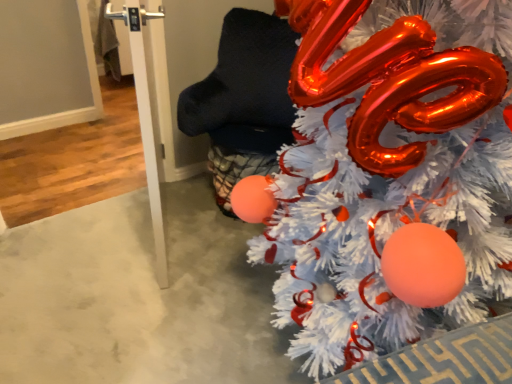
Question: Considering the positions of white glossy door handle at left and white fluffy christmas tree at right in the image, is white glossy door handle at left taller or shorter than white fluffy christmas tree at right?

Choices:
 (A) short
 (B) tall

Answer: (A)

Question: Is point (158, 215) closer or farther from the camera than point (415, 195)?

Choices:
 (A) farther
 (B) closer

Answer: (A)

Question: Relative to white fluffy christmas tree at right, is white glossy door handle at left in front or behind?

Choices:
 (A) behind
 (B) front

Answer: (A)

Question: Is white fluffy christmas tree at right in front of or behind white glossy door handle at left in the image?

Choices:
 (A) behind
 (B) front

Answer: (B)

Question: From the image's perspective, is white fluffy christmas tree at right positioned above or below white glossy door handle at left?

Choices:
 (A) below
 (B) above

Answer: (A)

Question: In terms of width, does white fluffy christmas tree at right look wider or thinner when compared to white glossy door handle at left?

Choices:
 (A) wide
 (B) thin

Answer: (A)

Question: Is white fluffy christmas tree at right inside the boundaries of white glossy door handle at left, or outside?

Choices:
 (A) outside
 (B) inside

Answer: (A)